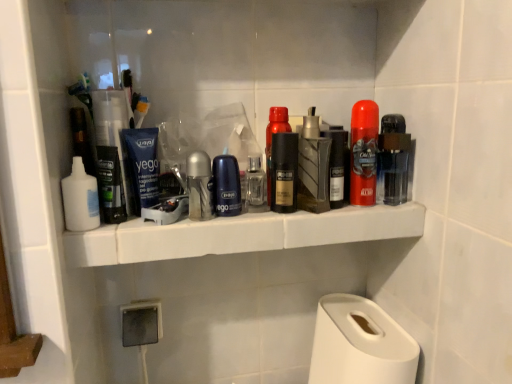
Question: From a real-world perspective, is blue matte tube at center, which is counted as the 7th personal care, starting from the right, above or below clear glass spray bottle at center, which appears as the 3th toiletry when viewed from the left?

Choices:
 (A) below
 (B) above

Answer: (B)

Question: Is blue matte tube at center, which appears as the 2th personal care when viewed from the left, spatially inside clear glass spray bottle at center, which appears as the 3th toiletry when viewed from the left, or outside of it?

Choices:
 (A) outside
 (B) inside

Answer: (A)

Question: Which of these objects is positioned farthest from the blue matte tube at center, which appears as the 2th personal care when viewed from the left?

Choices:
 (A) matte black deodorant at center, acting as the eighth personal care starting from the right
 (B) white matte lotion at left, acting as the first toiletry starting from the left
 (C) metallic gold can at center, placed as the 4th personal care when sorted from left to right
 (D) metallic silver razor at center, which ranks as the 3th personal care in right-to-left order
 (E) clear glass spray bottle at center, acting as the 2th toiletry starting from the right

Answer: (D)

Question: Estimate the real-world distances between objects in this image. Which object is farther from the white plastic shelf at center?

Choices:
 (A) blue matte deodorant at center, which is counted as the third personal care, starting from the left
 (B) matte black deodorant at center, arranged as the 1th personal care when viewed from the left
 (C) shiny red can at center, the second personal care in the right-to-left sequence
 (D) clear glass spray bottle at center, acting as the 2th toiletry starting from the right
 (E) matte black deodorant at center, which ranks as the fourth personal care in right-to-left order

Answer: (B)